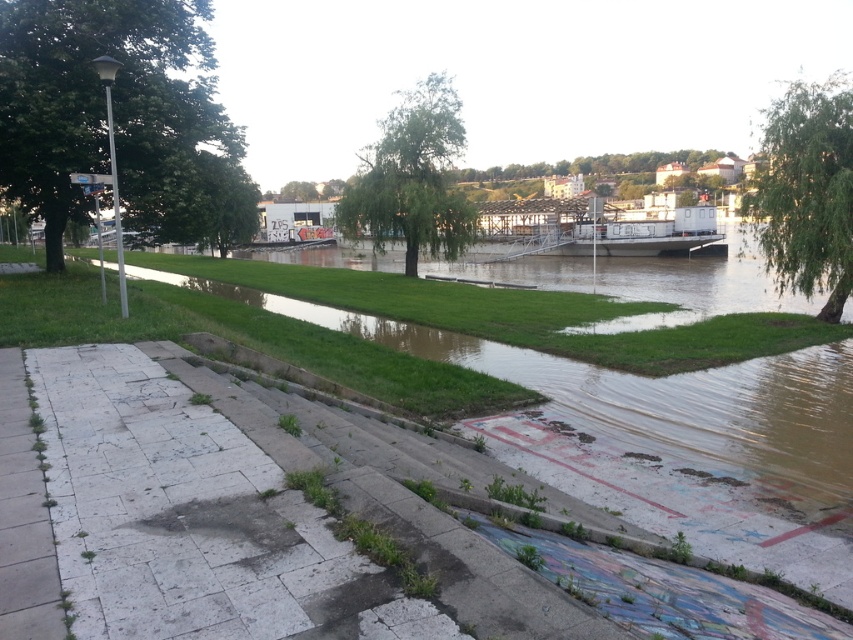
You are a delivery person carrying a heavy package and need to move from the gray concrete pavement at lower left to the gray concrete steps at lower left. The package is 10 feet long. Can you safely carry it while moving from the pavement to the steps?

The distance between the gray concrete steps at lower left and the gray concrete pavement at lower left is 9.64 feet. Since the package is 10 feet long, it is slightly longer than the available space. Therefore, you cannot safely carry it through this path.

You are standing at the camera position looking at the scene. There are two points marked in the image, one at point coordinates point (86,129) and another at point (837,282). Which point is nearer to you?

Point (86,129) is closer to the camera than point (837,282), so the point at coordinates point (86,129) is nearer to you.